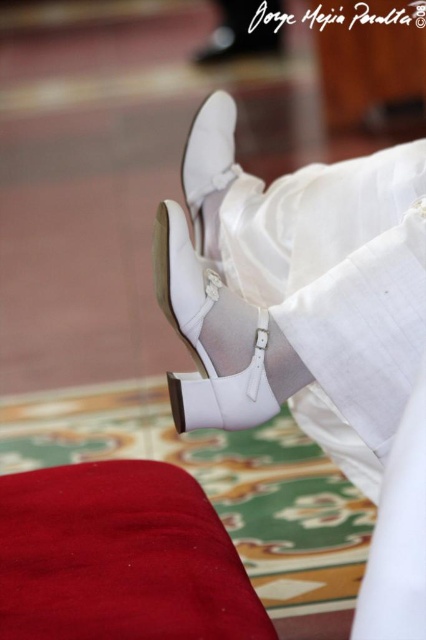
From the picture: Can you confirm if white leather shoes at center is thinner than white leather sandal at center?

No.

I want to click on white leather shoes at center, so click(298, 294).

Is point (370, 452) farther from camera compared to point (173, 419)?

Yes.

Where is `white leather shoes at center`? Image resolution: width=426 pixels, height=640 pixels. white leather shoes at center is located at coordinates (298, 294).

Between point (204, 604) and point (199, 161), which one is positioned behind?

The point (199, 161) is behind.

Is point (250, 637) closer to camera compared to point (207, 154)?

Yes, it is.

Where is `red velvet mat at lower left`? red velvet mat at lower left is located at coordinates (120, 557).

The image size is (426, 640). I want to click on red velvet mat at lower left, so click(x=120, y=557).

Between red velvet mat at lower left and white leather sandal at center, which one has more height?

white leather sandal at center

Identify the location of red velvet mat at lower left. (120, 557).